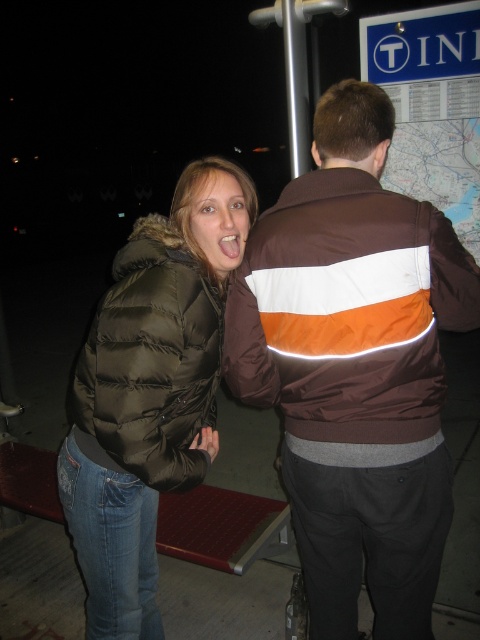
Question: Estimate the real-world distances between objects in this image. Which object is closer to the matte black puffer jacket at left?

Choices:
 (A) brown/white/orange striped jacket at center
 (B) dark green puffer jacket at left

Answer: (B)

Question: Which object is positioned closest to the brown/white/orange striped jacket at center?

Choices:
 (A) dark green puffer jacket at left
 (B) matte black puffer jacket at left

Answer: (A)

Question: Which of the following is the farthest from the observer?

Choices:
 (A) brown/white/orange striped jacket at center
 (B) matte black puffer jacket at left
 (C) dark green puffer jacket at left

Answer: (B)

Question: Does brown/white/orange striped jacket at center appear on the right side of matte black puffer jacket at left?

Choices:
 (A) yes
 (B) no

Answer: (A)

Question: Does brown/white/orange striped jacket at center have a smaller size compared to matte black puffer jacket at left?

Choices:
 (A) no
 (B) yes

Answer: (B)

Question: Is brown/white/orange striped jacket at center closer to the viewer compared to matte black puffer jacket at left?

Choices:
 (A) yes
 (B) no

Answer: (A)